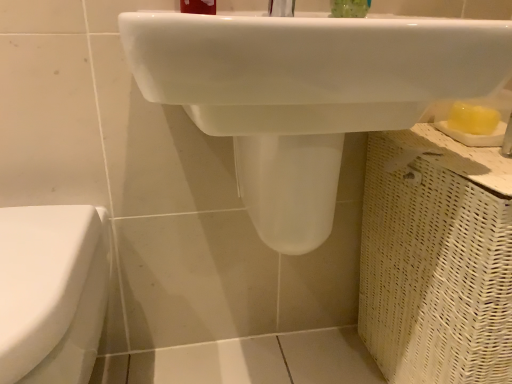
This screenshot has height=384, width=512. What do you see at coordinates (349, 8) in the screenshot? I see `green translucent soap at upper center` at bounding box center [349, 8].

Where is `matte plastic toothbrush at upper center`? The width and height of the screenshot is (512, 384). matte plastic toothbrush at upper center is located at coordinates (198, 6).

Does green translucent soap at upper center have a smaller size compared to matte plastic toothbrush at upper center?

Yes, green translucent soap at upper center is smaller than matte plastic toothbrush at upper center.

Does green translucent soap at upper center turn towards matte plastic toothbrush at upper center?

No, green translucent soap at upper center is not oriented towards matte plastic toothbrush at upper center.

Find the location of `toiletry above the green translucent soap at upper center (from the image's perspective)`. toiletry above the green translucent soap at upper center (from the image's perspective) is located at coordinates (198, 6).

Is green translucent soap at upper center with matte plastic toothbrush at upper center?

No, green translucent soap at upper center is not beside matte plastic toothbrush at upper center.

From a real-world perspective, who is located lower, matte plastic toothbrush at upper center or green translucent soap at upper center?

green translucent soap at upper center.

Identify the location of liquid on the right of matte plastic toothbrush at upper center. The height and width of the screenshot is (384, 512). (349, 8).

Is matte plastic toothbrush at upper center turned away from green translucent soap at upper center?

No.

Is matte plastic toothbrush at upper center far away from green translucent soap at upper center?

No, there isn't a large distance between matte plastic toothbrush at upper center and green translucent soap at upper center.

Between white glossy sink at upper center and green translucent soap at upper center, which one is positioned in front?

white glossy sink at upper center is in front.

Is white glossy sink at upper center not within green translucent soap at upper center?

Yes, white glossy sink at upper center is located beyond the bounds of green translucent soap at upper center.

Is white glossy sink at upper center facing away from green translucent soap at upper center?

white glossy sink at upper center is not turned away from green translucent soap at upper center.

From the image's perspective, which object appears higher, white glossy toilet at left or green translucent soap at upper center?

green translucent soap at upper center, from the image's perspective.

Considering the relative positions of white glossy toilet at left and green translucent soap at upper center in the image provided, is white glossy toilet at left to the right of green translucent soap at upper center from the viewer's perspective?

No.

Identify the location of toilet below the green translucent soap at upper center (from the image's perspective). Image resolution: width=512 pixels, height=384 pixels. (51, 292).

Can you confirm if white glossy toilet at left is smaller than green translucent soap at upper center?

No, white glossy toilet at left is not smaller than green translucent soap at upper center.

The height and width of the screenshot is (384, 512). Find the location of `sink located in front of the green translucent soap at upper center`. sink located in front of the green translucent soap at upper center is located at coordinates (306, 94).

Is green translucent soap at upper center positioned behind white glossy sink at upper center?

Yes, the depth of green translucent soap at upper center is greater than that of white glossy sink at upper center.

Is green translucent soap at upper center oriented away from white glossy sink at upper center?

No.

Locate an element on the screen. This screenshot has height=384, width=512. sink below the matte plastic toothbrush at upper center (from the image's perspective) is located at coordinates (306, 94).

Is white glossy sink at upper center inside matte plastic toothbrush at upper center?

That's incorrect, white glossy sink at upper center is not inside matte plastic toothbrush at upper center.

Between matte plastic toothbrush at upper center and white glossy sink at upper center, which one has larger width?

Wider between the two is white glossy sink at upper center.

Is matte plastic toothbrush at upper center facing towards white glossy sink at upper center?

No, matte plastic toothbrush at upper center is not aimed at white glossy sink at upper center.

Could you tell me if matte plastic toothbrush at upper center is facing white glossy toilet at left?

No, matte plastic toothbrush at upper center does not turn towards white glossy toilet at left.

Considering the relative sizes of matte plastic toothbrush at upper center and white glossy toilet at left in the image provided, is matte plastic toothbrush at upper center thinner than white glossy toilet at left?

Yes.

Is matte plastic toothbrush at upper center spatially inside white glossy toilet at left, or outside of it?

matte plastic toothbrush at upper center is not enclosed by white glossy toilet at left.

Consider the image. Considering the sizes of matte plastic toothbrush at upper center and white glossy toilet at left in the image, is matte plastic toothbrush at upper center taller or shorter than white glossy toilet at left?

In the image, matte plastic toothbrush at upper center appears to be shorter than white glossy toilet at left.

Locate an element on the screen. The height and width of the screenshot is (384, 512). toiletry that is above the green translucent soap at upper center (from a real-world perspective) is located at coordinates (198, 6).

Find the location of `liquid on the right side of matte plastic toothbrush at upper center`. liquid on the right side of matte plastic toothbrush at upper center is located at coordinates (349, 8).

Which object lies nearer to the anchor point white glossy toilet at left, white glossy sink at upper center or green translucent soap at upper center?

white glossy sink at upper center lies closer to white glossy toilet at left than the other object.

Which object lies further to the anchor point green translucent soap at upper center, white glossy toilet at left or white glossy sink at upper center?

white glossy toilet at left lies further to green translucent soap at upper center than the other object.

Based on their spatial positions, is matte plastic toothbrush at upper center or white glossy toilet at left further from green translucent soap at upper center?

Based on the image, white glossy toilet at left appears to be further to green translucent soap at upper center.

When comparing their distances from white glossy sink at upper center, does green translucent soap at upper center or matte plastic toothbrush at upper center seem closer?

Based on the image, matte plastic toothbrush at upper center appears to be nearer to white glossy sink at upper center.

Based on the photo, looking at the image, which one is located further to green translucent soap at upper center, white glossy sink at upper center or white glossy toilet at left?

Based on the image, white glossy toilet at left appears to be further to green translucent soap at upper center.

Looking at the image, which one is located closer to green translucent soap at upper center, matte plastic toothbrush at upper center or white glossy sink at upper center?

matte plastic toothbrush at upper center is positioned closer to the anchor green translucent soap at upper center.

Looking at the image, which one is located closer to matte plastic toothbrush at upper center, green translucent soap at upper center or white glossy sink at upper center?

green translucent soap at upper center.

From the image, which object appears to be nearer to white glossy toilet at left, white glossy sink at upper center or matte plastic toothbrush at upper center?

The object closer to white glossy toilet at left is white glossy sink at upper center.

You are a GUI agent. You are given a task and a screenshot of the screen. Output one action in this format:
    pyautogui.click(x=<x>, y=<y>)
    Task: Click on the liquid between matte plastic toothbrush at upper center and white glossy sink at upper center in the vertical direction
    The image size is (512, 384).
    Given the screenshot: What is the action you would take?
    pyautogui.click(x=349, y=8)

Where is `sink between matte plastic toothbrush at upper center and white glossy toilet at left in the up-down direction`? sink between matte plastic toothbrush at upper center and white glossy toilet at left in the up-down direction is located at coordinates (306, 94).

This screenshot has height=384, width=512. In order to click on sink between green translucent soap at upper center and white glossy toilet at left from top to bottom in this screenshot , I will do `click(306, 94)`.

This screenshot has height=384, width=512. What are the coordinates of `liquid between matte plastic toothbrush at upper center and white glossy toilet at left vertically` in the screenshot? It's located at (349, 8).